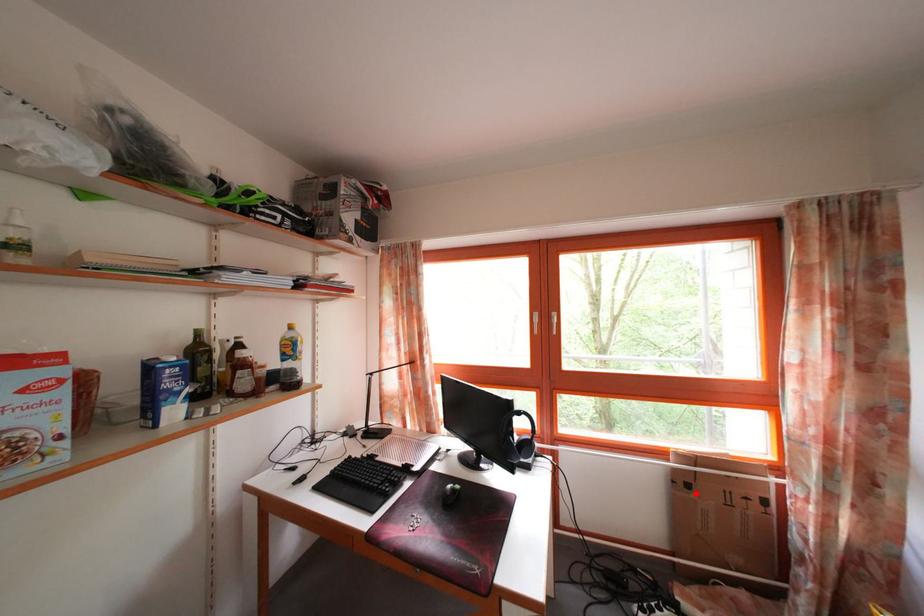
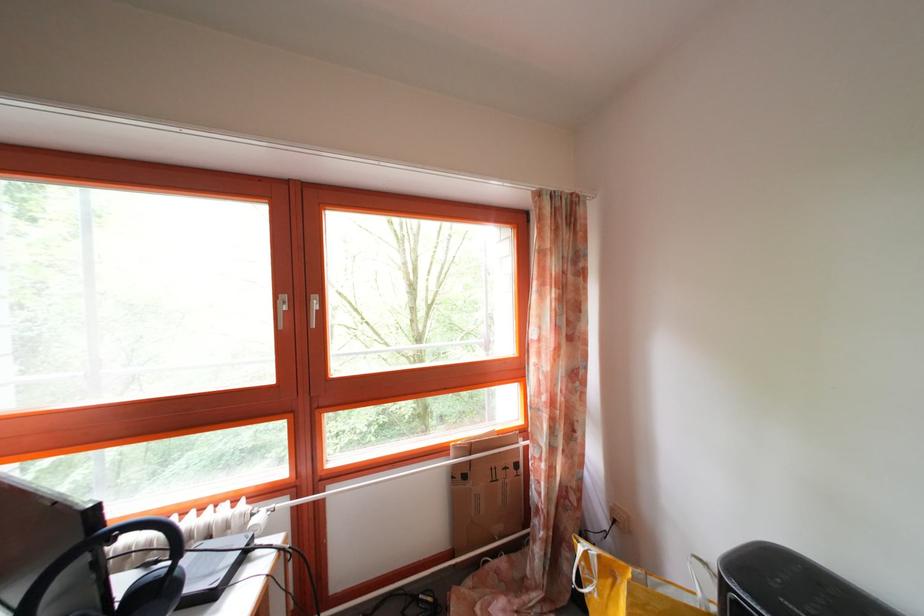
Question: I am providing you with two images of the same scene from different viewpoints. Given a red point in image1, look at the same physical point in image2. Is it:

Choices:
 (A) Closer to the viewpoint
 (B) Farther from the viewpoint

Answer: (B)